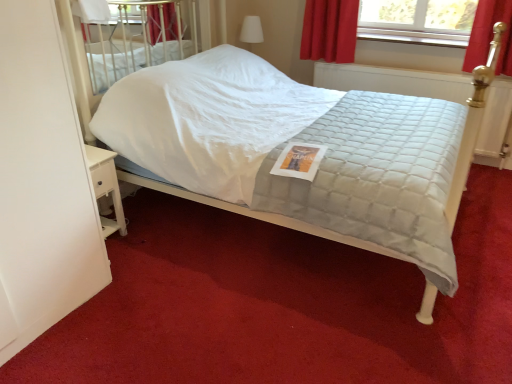
Locate an element on the screen. Image resolution: width=512 pixels, height=384 pixels. vacant space to the right of white wood nightstand at lower left is located at coordinates (138, 233).